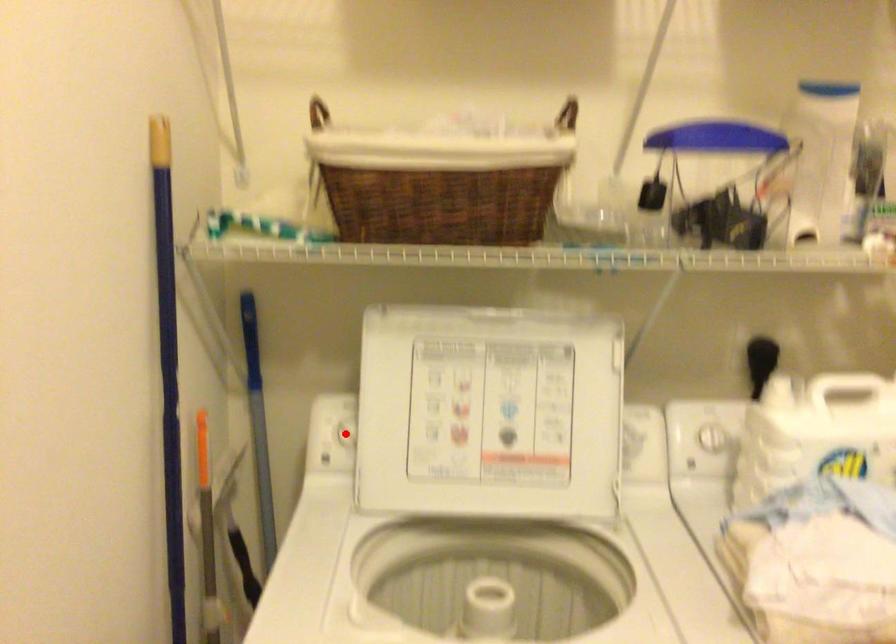
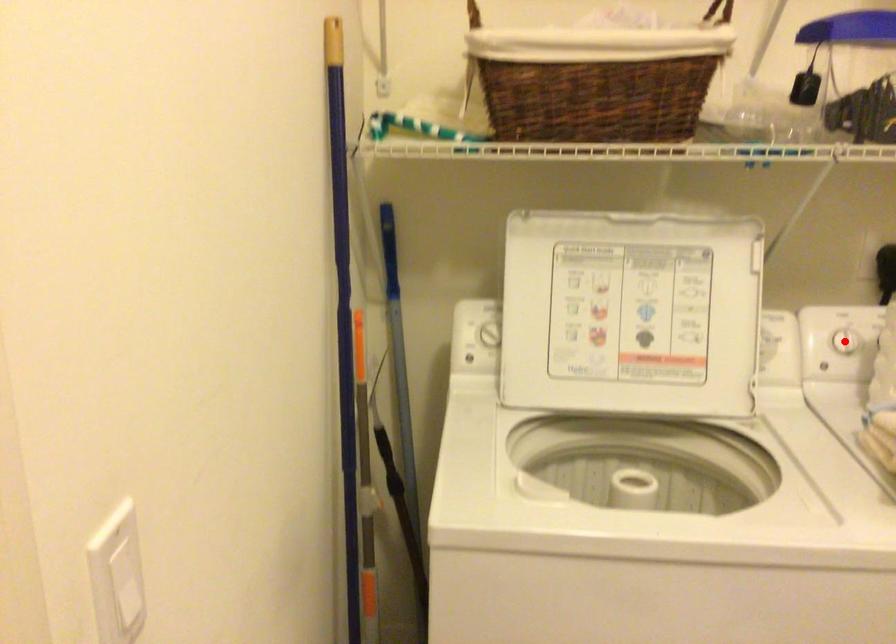
I am providing you with two images of the same scene from different viewpoints. A red point is marked on the first image and another point is marked on the second image. Are the points marked in image1 and image2 representing the same 3D position?

No